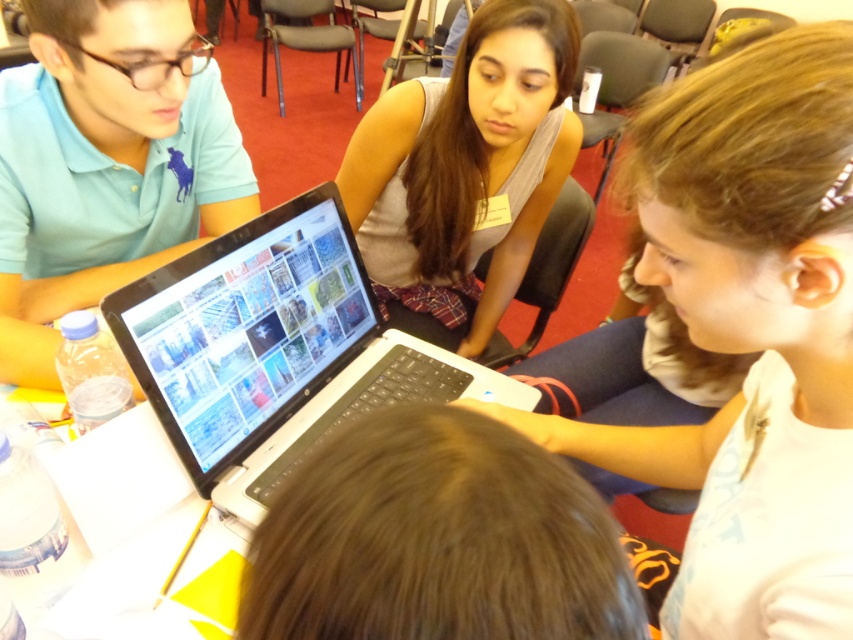
Consider the image. Where is the brown hair at center located in the image?

The brown hair at center is located at point coordinates of 0.844 on the x axis and 0.512 on the y axis.

You are a photographer standing 10 feet away from the group. You want to take a photo of both the brown hair at center and the matte blue polo shirt at left in the same frame. Can you fit both subjects into the photo without zooming in?

The brown hair at center and the matte blue polo shirt at left are 34.28 inches apart. At 10 feet distance, a standard camera can easily capture both subjects in the same frame without needing to zoom in, as the distance between them is within typical framing capabilities.